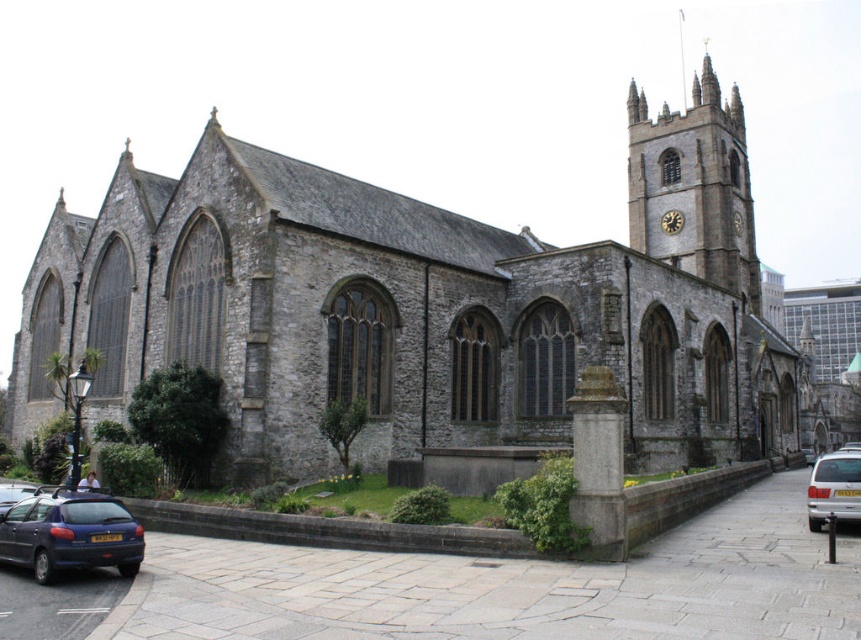
Question: Which of the following is the closest to the observer?

Choices:
 (A) silver metallic van at lower right
 (B) gray stone church at center

Answer: (A)

Question: Is gray stone church at center positioned in front of matte blue car at lower left?

Choices:
 (A) yes
 (B) no

Answer: (B)

Question: Which of the following is the farthest from the observer?

Choices:
 (A) metallic blue car at lower left
 (B) matte blue car at lower left
 (C) silver metallic van at lower right
 (D) stone clock tower at upper right

Answer: (D)

Question: Does matte blue car at lower left lie in front of metallic blue car at lower left?

Choices:
 (A) yes
 (B) no

Answer: (A)

Question: Which point is closer to the camera?

Choices:
 (A) (821, 488)
 (B) (719, 253)
 (C) (22, 493)

Answer: (C)

Question: Does stone clock tower at upper right appear over metallic blue car at lower left?

Choices:
 (A) no
 (B) yes

Answer: (B)